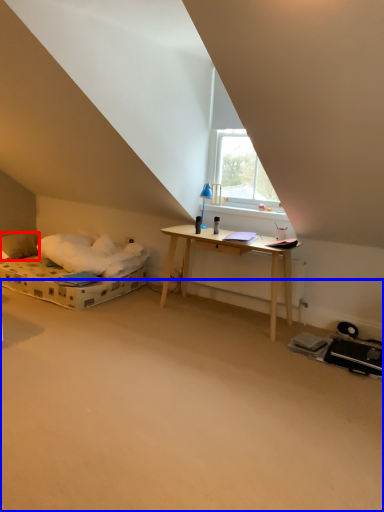
Question: Which object is further to the camera taking this photo, pillow (highlighted by a red box) or plain (highlighted by a blue box)?

Choices:
 (A) pillow
 (B) plain

Answer: (A)